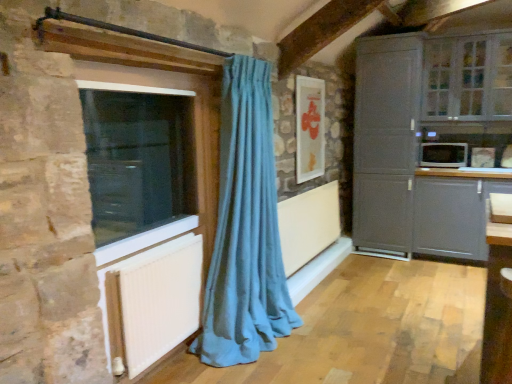
Image resolution: width=512 pixels, height=384 pixels. I want to click on vacant area located to the right-hand side of teal fabric curtain at left, so click(333, 337).